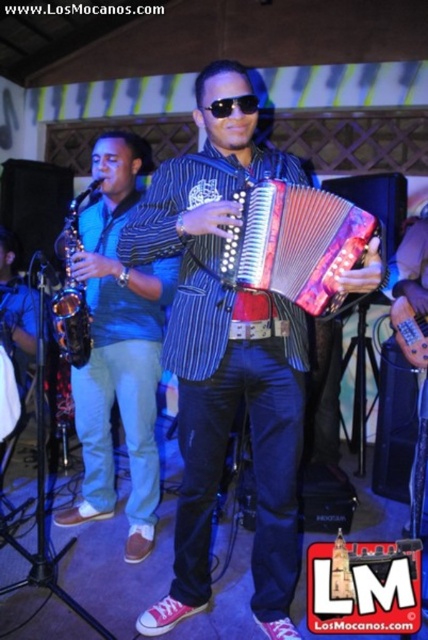
Question: Can you confirm if brushed metal saxophone at left is thinner than shiny metallic accordion at center?

Choices:
 (A) yes
 (B) no

Answer: (B)

Question: Is shiny blue jeans at center bigger than black plastic sunglasses at center?

Choices:
 (A) yes
 (B) no

Answer: (A)

Question: Does shiny blue jeans at center appear over shiny metallic accordion at center?

Choices:
 (A) no
 (B) yes

Answer: (A)

Question: Which of the following is the closest to the observer?

Choices:
 (A) black plastic sunglasses at center
 (B) shiny blue jeans at center
 (C) shiny metallic accordion at center
 (D) brushed metal saxophone at left

Answer: (B)

Question: Which is farther from the black plastic sunglasses at center?

Choices:
 (A) satin gold saxophone at left
 (B) shiny blue jeans at center

Answer: (A)

Question: Estimate the real-world distances between objects in this image. Which object is farther from the brushed metal saxophone at left?

Choices:
 (A) satin gold saxophone at left
 (B) black plastic sunglasses at center
 (C) shiny metallic accordion at center
 (D) shiny blue jeans at center

Answer: (B)